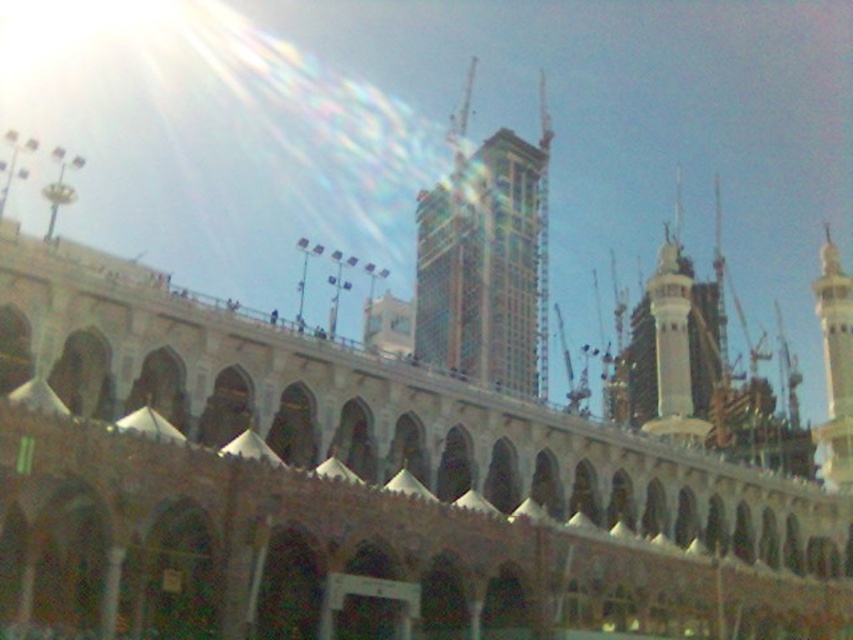
Which is above, green mosaic tower at center or white glossy minaret at right?

green mosaic tower at center is above.

Can you confirm if green mosaic tower at center is shorter than white glossy minaret at right?

Incorrect, green mosaic tower at center's height does not fall short of white glossy minaret at right's.

The width and height of the screenshot is (853, 640). Identify the location of green mosaic tower at center. (486, 262).